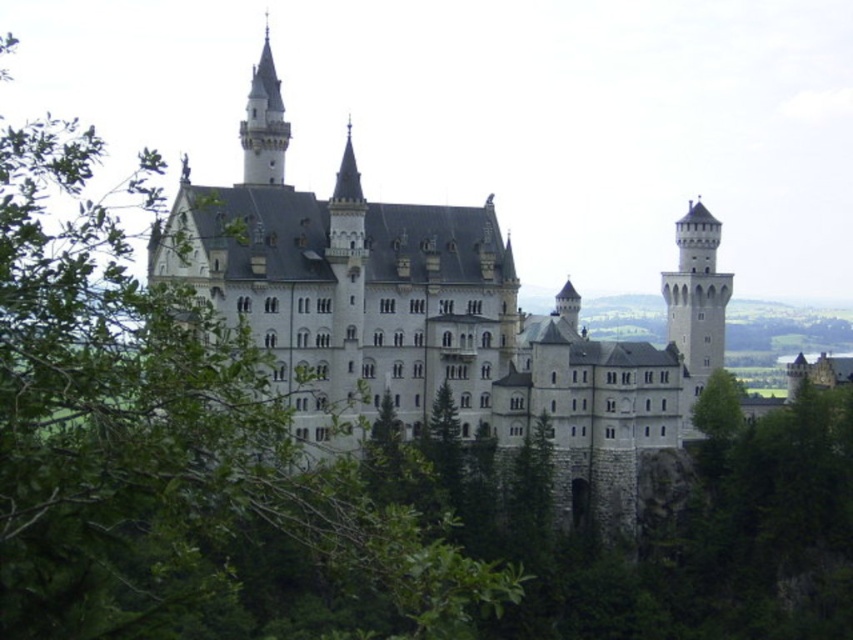
Based on the coordinates provided, which object in the scene is located at point (425, 330)?

The white stone castle at center is located at point (425, 330).

You are an architect analyzing the castle structure. You notice the white stone tower at right and the stone spire at upper left. Which of these two objects is bigger in size?

The white stone tower at right is larger in size compared to the stone spire at upper left.